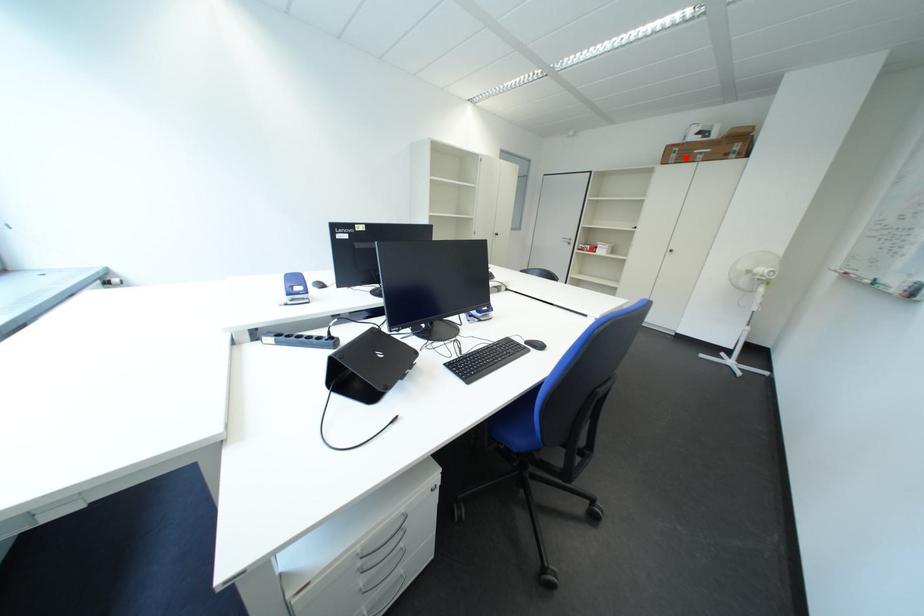
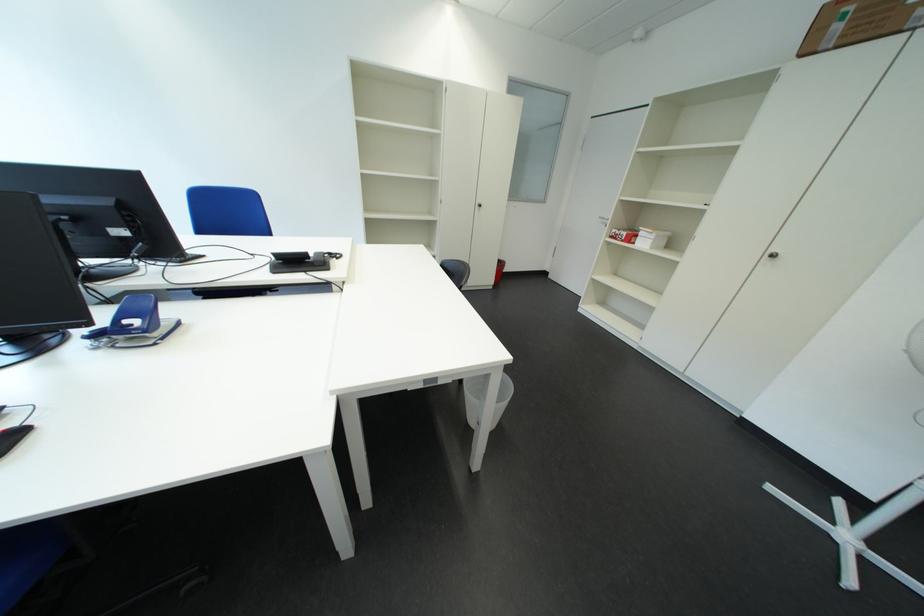
Where in the second image is the point corresponding to the highlighted location from the first image?

(849, 30)